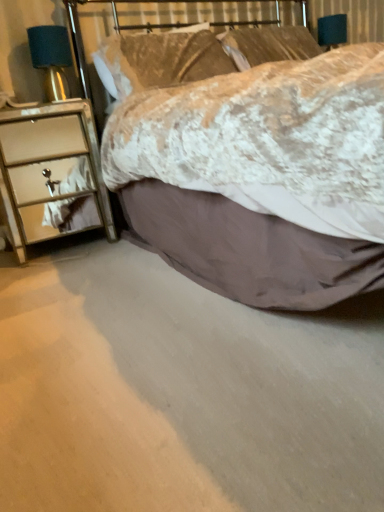
Question: Which direction should I rotate to face linen pillow at upper center, the 2th pillow in the right-to-left sequence, — up or down?

Choices:
 (A) down
 (B) up

Answer: (B)

Question: Is satin teal lampshade at left taller than linen pillow at upper center, the 2th pillow in the right-to-left sequence?

Choices:
 (A) no
 (B) yes

Answer: (A)

Question: Can you confirm if satin teal lampshade at left is bigger than linen pillow at upper center, the first pillow from the left?

Choices:
 (A) no
 (B) yes

Answer: (A)

Question: Is linen pillow at upper center, the first pillow from the left, at the back of satin teal lampshade at left?

Choices:
 (A) no
 (B) yes

Answer: (A)

Question: From the image's perspective, is satin teal lampshade at left under linen pillow at upper center, the 2th pillow in the right-to-left sequence?

Choices:
 (A) yes
 (B) no

Answer: (A)

Question: From a real-world perspective, is satin teal lampshade at left beneath linen pillow at upper center, the 2th pillow in the right-to-left sequence?

Choices:
 (A) no
 (B) yes

Answer: (A)

Question: Is satin teal lampshade at left far from linen pillow at upper center, the 2th pillow in the right-to-left sequence?

Choices:
 (A) no
 (B) yes

Answer: (A)

Question: Does metallic mirrored chest of drawers at left have a lesser height compared to linen pillow at upper center, the 2th pillow in the right-to-left sequence?

Choices:
 (A) yes
 (B) no

Answer: (B)

Question: Is metallic mirrored chest of drawers at left smaller than linen pillow at upper center, the 2th pillow in the right-to-left sequence?

Choices:
 (A) yes
 (B) no

Answer: (B)

Question: From the image's perspective, does metallic mirrored chest of drawers at left appear lower than linen pillow at upper center, the first pillow from the left?

Choices:
 (A) yes
 (B) no

Answer: (A)

Question: Can you confirm if metallic mirrored chest of drawers at left is positioned to the right of linen pillow at upper center, the 2th pillow in the right-to-left sequence?

Choices:
 (A) no
 (B) yes

Answer: (A)

Question: Does metallic mirrored chest of drawers at left lie behind linen pillow at upper center, the first pillow from the left?

Choices:
 (A) no
 (B) yes

Answer: (A)

Question: Is metallic mirrored chest of drawers at left next to linen pillow at upper center, the first pillow from the left, and touching it?

Choices:
 (A) no
 (B) yes

Answer: (A)

Question: Can you confirm if velvet-like beige bed at center is smaller than linen pillow at upper center, which appears as the first pillow when viewed from the right?

Choices:
 (A) yes
 (B) no

Answer: (B)